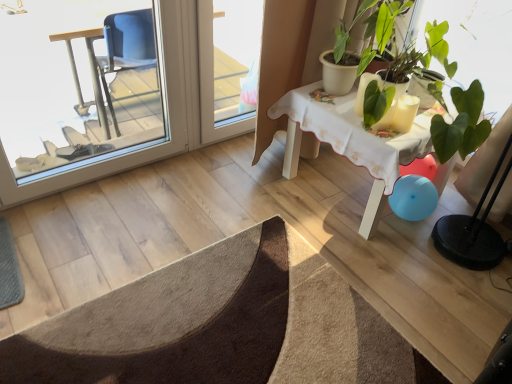
Where is `free space in front of white glossy candle at upper right`? The image size is (512, 384). free space in front of white glossy candle at upper right is located at coordinates (406, 133).